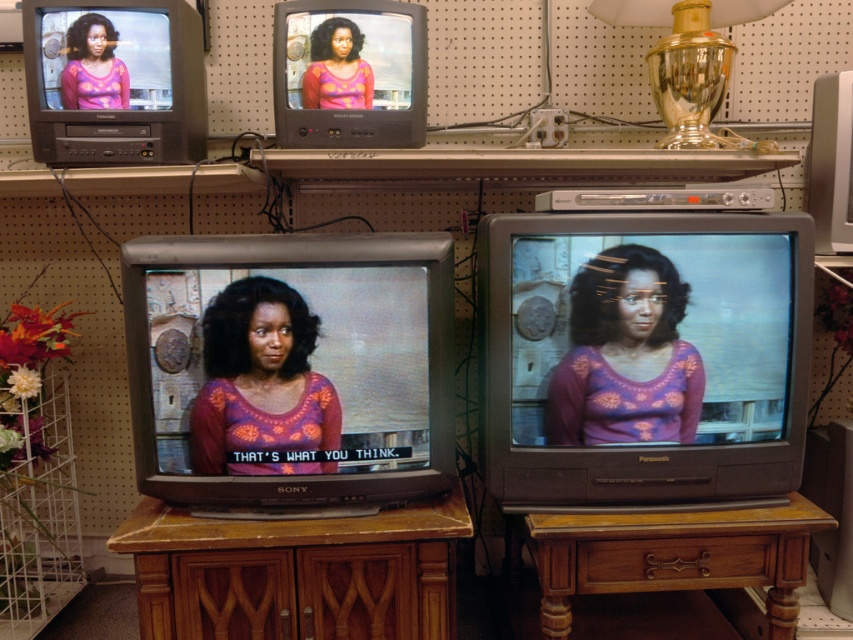
You are a customer in an antique store and see the purple floral sweater at center and the gold glass lamp at upper right. Which item is located below the other?

The purple floral sweater at center is positioned under the gold glass lamp at upper right.

You are standing in front of the vintage TV display. There are two points marked on the wall. The first point is at coordinates point (663, 20) and the second is at point (341, 77). Which point is closer to you?

Point (663, 20) is closer to you because it is further to the viewer than point (341, 77).